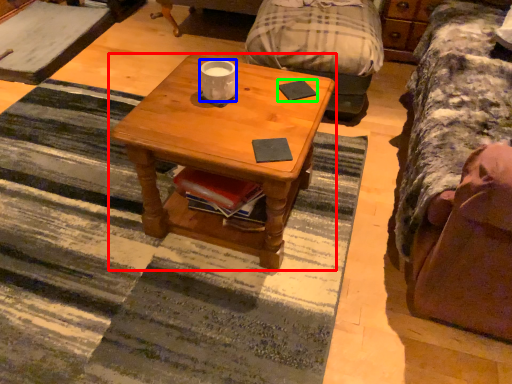
Question: Which is farther away from coffee table (highlighted by a red box)? coffee cup (highlighted by a blue box) or pad (highlighted by a green box)?

Choices:
 (A) coffee cup
 (B) pad

Answer: (B)